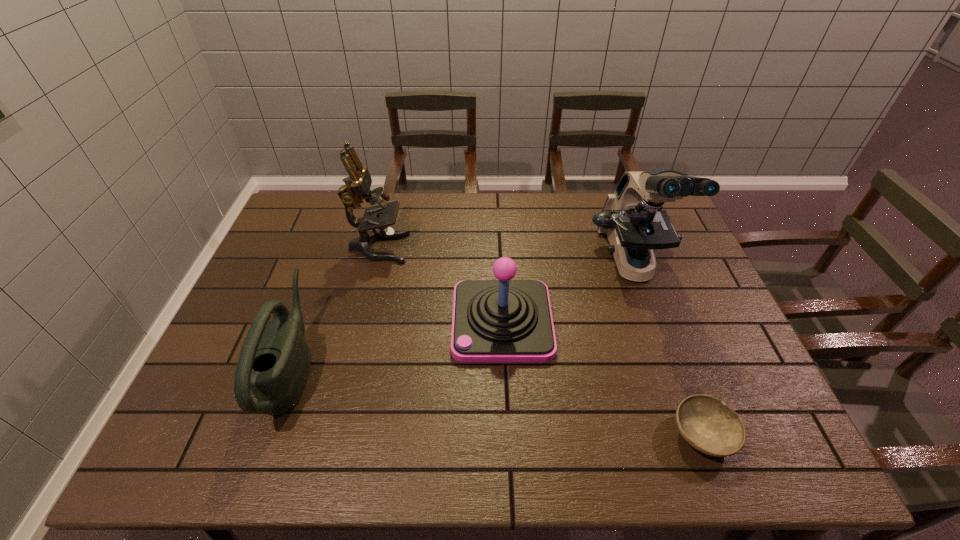
In the image, there is a desktop. Where is `vacant space at the far edge`? The width and height of the screenshot is (960, 540). vacant space at the far edge is located at coordinates (495, 224).

This screenshot has width=960, height=540. I want to click on vacant space at the near edge, so click(x=542, y=447).

At what (x,y) coordinates should I click in order to perform the action: click on free spot at the left edge of the desktop. Please return your answer as a coordinate pair (x, y). Looking at the image, I should click on (278, 249).

In the image, there is a desktop. Where is `free region at the right edge`? This screenshot has height=540, width=960. free region at the right edge is located at coordinates coord(744,417).

Image resolution: width=960 pixels, height=540 pixels. Find the location of `vacant point located between the watering can and the shortest object`. vacant point located between the watering can and the shortest object is located at coordinates (498, 401).

Where is `blank region between the left microscope and the joystick`? Image resolution: width=960 pixels, height=540 pixels. blank region between the left microscope and the joystick is located at coordinates (441, 285).

Find the location of a particular element. The image size is (960, 540). vacant area that lies between the third object from left to right and the right microscope is located at coordinates (567, 293).

This screenshot has width=960, height=540. Find the location of `unoccupied area between the right microscope and the joystick`. unoccupied area between the right microscope and the joystick is located at coordinates (567, 293).

This screenshot has height=540, width=960. I want to click on empty space that is in between the bowl and the right microscope, so click(x=667, y=349).

Find the location of a particular element. This screenshot has height=540, width=960. empty location between the joystick and the right microscope is located at coordinates (567, 293).